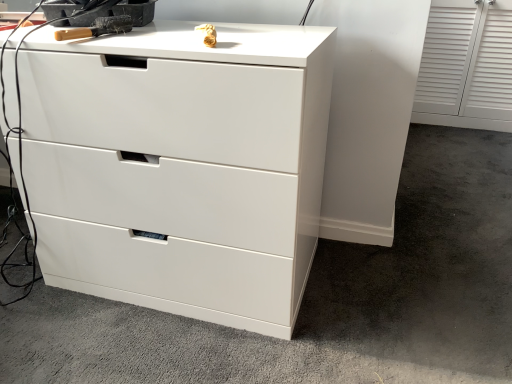
Question: In terms of size, does wooden-handled brush at upper left appear bigger or smaller than white glossy drawer at center?

Choices:
 (A) small
 (B) big

Answer: (A)

Question: Is wooden-handled brush at upper left wider or thinner than white glossy drawer at center?

Choices:
 (A) wide
 (B) thin

Answer: (B)

Question: Estimate the real-world distances between objects in this image. Which object is farther from the white glossy chest of drawers at center?

Choices:
 (A) wooden-handled brush at upper left
 (B) white glossy drawer at center

Answer: (A)

Question: Based on their relative distances, which object is nearer to the white glossy chest of drawers at center?

Choices:
 (A) white glossy drawer at center
 (B) wooden-handled brush at upper left

Answer: (A)